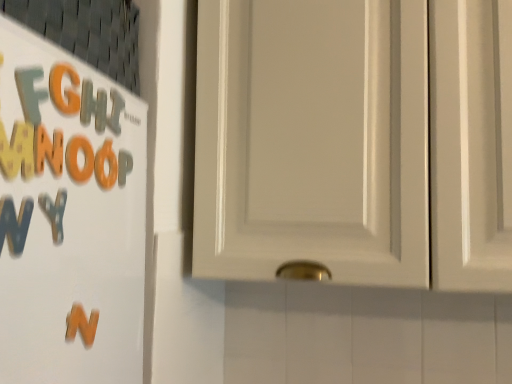
Question: Is orange matte letter n at left outside matte orange letter g at upper left, the 5th letter from the back?

Choices:
 (A) yes
 (B) no

Answer: (A)

Question: Is orange matte letter n at left bigger than matte orange letter g at upper left, the second letter in the front-to-back sequence?

Choices:
 (A) no
 (B) yes

Answer: (B)

Question: Is orange matte letter n at left aimed at matte orange letter g at upper left, the second letter in the front-to-back sequence?

Choices:
 (A) no
 (B) yes

Answer: (A)

Question: From a real-world perspective, is orange matte letter n at left physically below matte orange letter g at upper left, the 5th letter from the back?

Choices:
 (A) no
 (B) yes

Answer: (B)

Question: From the image's perspective, does orange matte letter n at left appear lower than matte orange letter g at upper left, the second letter in the front-to-back sequence?

Choices:
 (A) no
 (B) yes

Answer: (B)

Question: Considering their positions, is matte plastic letter at upper left, which ranks as the fifth letter in front-to-back order, located in front of or behind matte orange letter g at upper left, the second letter in the front-to-back sequence?

Choices:
 (A) front
 (B) behind

Answer: (B)

Question: Is point (114, 104) positioned closer to the camera than point (67, 109)?

Choices:
 (A) farther
 (B) closer

Answer: (A)

Question: Would you say matte plastic letter at upper left, which ranks as the fifth letter in front-to-back order, is to the left or to the right of matte orange letter g at upper left, the second letter in the front-to-back sequence, in the picture?

Choices:
 (A) left
 (B) right

Answer: (B)

Question: Considering the positions of matte plastic letter at upper left, acting as the 2th letter starting from the back, and matte orange letter g at upper left, the second letter in the front-to-back sequence, in the image, is matte plastic letter at upper left, acting as the 2th letter starting from the back, wider or thinner than matte orange letter g at upper left, the second letter in the front-to-back sequence,?

Choices:
 (A) thin
 (B) wide

Answer: (B)

Question: From the image's perspective, relative to matte plastic letter at upper left, which ranks as the fifth letter in front-to-back order, is matte orange letter g at upper left, the second letter in the front-to-back sequence, above or below?

Choices:
 (A) below
 (B) above

Answer: (B)

Question: In the image, is matte orange letter g at upper left, the second letter in the front-to-back sequence, on the left side or the right side of matte plastic letter at upper left, acting as the 2th letter starting from the back?

Choices:
 (A) left
 (B) right

Answer: (A)

Question: Is matte orange letter g at upper left, the second letter in the front-to-back sequence, inside the boundaries of matte plastic letter at upper left, acting as the 2th letter starting from the back, or outside?

Choices:
 (A) outside
 (B) inside

Answer: (A)

Question: Considering the positions of matte orange letter g at upper left, the second letter in the front-to-back sequence, and matte plastic letter at upper left, acting as the 2th letter starting from the back, in the image, is matte orange letter g at upper left, the second letter in the front-to-back sequence, bigger or smaller than matte plastic letter at upper left, acting as the 2th letter starting from the back,?

Choices:
 (A) big
 (B) small

Answer: (B)

Question: Based on their sizes in the image, would you say orange foam letter at left, placed as the 6th letter when sorted from back to front, is bigger or smaller than matte white cabinet at upper right?

Choices:
 (A) big
 (B) small

Answer: (B)

Question: Is point (61, 163) positioned closer to the camera than point (318, 92)?

Choices:
 (A) closer
 (B) farther

Answer: (A)